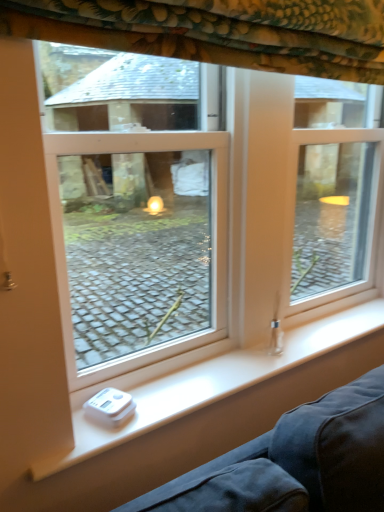
Question: From a real-world perspective, is white plastic window at center positioned over white plastic scale at lower left based on gravity?

Choices:
 (A) no
 (B) yes

Answer: (B)

Question: Can you confirm if white plastic window at center is positioned to the left of white plastic scale at lower left?

Choices:
 (A) yes
 (B) no

Answer: (A)

Question: Is white plastic window at center to the right of white plastic scale at lower left from the viewer's perspective?

Choices:
 (A) no
 (B) yes

Answer: (A)

Question: Does white plastic window at center lie in front of white plastic scale at lower left?

Choices:
 (A) yes
 (B) no

Answer: (A)

Question: Does white plastic window at center have a greater width compared to white plastic scale at lower left?

Choices:
 (A) no
 (B) yes

Answer: (A)

Question: Based on their positions, is white plastic scale at lower left located to the left or right of floral fabric curtain at upper center?

Choices:
 (A) right
 (B) left

Answer: (A)

Question: Is white plastic scale at lower left taller or shorter than floral fabric curtain at upper center?

Choices:
 (A) short
 (B) tall

Answer: (A)

Question: From the image's perspective, relative to floral fabric curtain at upper center, is white plastic scale at lower left above or below?

Choices:
 (A) below
 (B) above

Answer: (A)

Question: Based on their sizes in the image, would you say white plastic scale at lower left is bigger or smaller than floral fabric curtain at upper center?

Choices:
 (A) big
 (B) small

Answer: (B)

Question: Is point (246, 13) closer or farther from the camera than point (96, 438)?

Choices:
 (A) farther
 (B) closer

Answer: (B)

Question: Is floral fabric curtain at upper center wider or thinner than white plastic scale at lower left?

Choices:
 (A) thin
 (B) wide

Answer: (B)

Question: In the image, is floral fabric curtain at upper center on the left side or the right side of white plastic scale at lower left?

Choices:
 (A) left
 (B) right

Answer: (A)

Question: Is floral fabric curtain at upper center spatially inside white plastic scale at lower left, or outside of it?

Choices:
 (A) outside
 (B) inside

Answer: (A)

Question: Based on their sizes in the image, would you say white plastic window at center is bigger or smaller than white plastic scale at lower left?

Choices:
 (A) small
 (B) big

Answer: (B)

Question: Looking at their shapes, would you say white plastic window at center is wider or thinner than white plastic scale at lower left?

Choices:
 (A) wide
 (B) thin

Answer: (B)